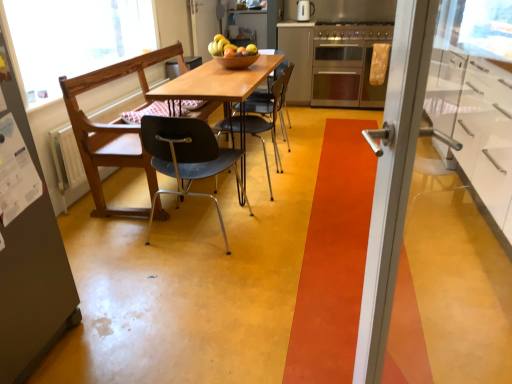
Where is `vacant region under matte black chair at center, positioned as the third chair in back-to-front order (from a real-world perspective)`? Image resolution: width=512 pixels, height=384 pixels. vacant region under matte black chair at center, positioned as the third chair in back-to-front order (from a real-world perspective) is located at coordinates (212, 230).